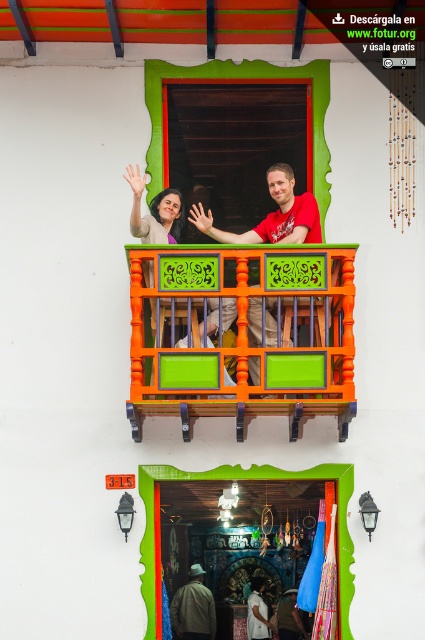
You are standing in front of a building and want to locate the orange painted wood balcony at center. According to the coordinates provided, where exactly would you look to find it?

The orange painted wood balcony at center is located at point coordinates 0.527 on the x axis and 0.574 on the y axis.

You are standing on the ground floor looking up at the orange painted wood balcony at center and the matte purple blouse at upper center. Which object is higher from the ground?

The orange painted wood balcony at center is higher from the ground than the matte purple blouse at upper center because it has a greater height compared to it.

You are a tailor trying to fit a customer for a jacket. You observe the red matte shirt at center and the dark brown leather jacket at center in the image. Which item of clothing appears to be larger in size?

The dark brown leather jacket at center is larger in size compared to the red matte shirt at center.